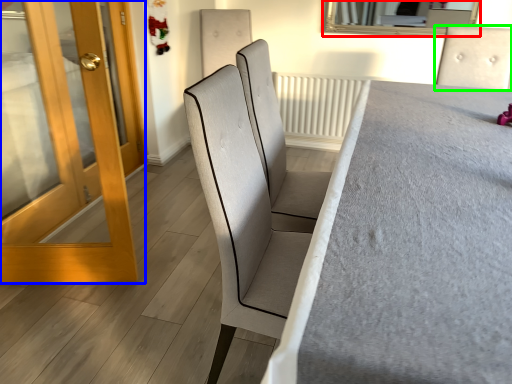
Question: Which object is the closest to the mirror (highlighted by a red box)? Choose among these: door (highlighted by a blue box) or chair (highlighted by a green box).

Choices:
 (A) door
 (B) chair

Answer: (B)